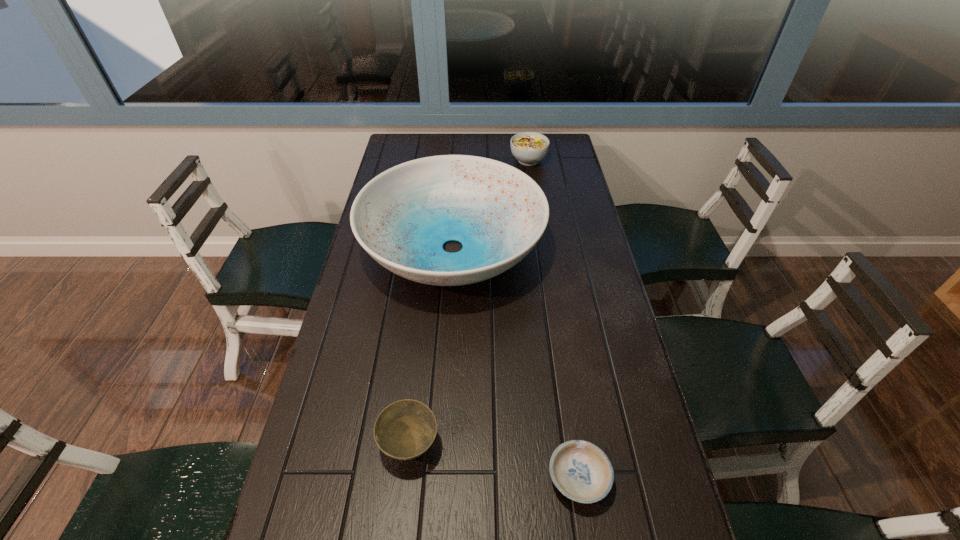
Find the location of a particular element. the tallest object is located at coordinates (402, 218).

Identify the location of the second farthest object. The image size is (960, 540). (402, 218).

Where is `the farthest object`? The width and height of the screenshot is (960, 540). the farthest object is located at coordinates (529, 148).

The image size is (960, 540). In order to click on the taller bowl in this screenshot , I will do `click(406, 429)`.

What are the coordinates of `the shortest object` in the screenshot? It's located at (581, 471).

The width and height of the screenshot is (960, 540). Find the location of `the shorter bowl`. the shorter bowl is located at coordinates (581, 471).

Image resolution: width=960 pixels, height=540 pixels. I want to click on free space located 0.120m on the right of the second farthest object, so click(x=582, y=248).

Locate an element on the screen. vacant space situated 0.120m on the left of the farthest object is located at coordinates (480, 160).

You are a GUI agent. You are given a task and a screenshot of the screen. Output one action in this format:
    pyautogui.click(x=<x>, y=<y>)
    Task: Click on the vacant space located on the left of the left bowl
    The image size is (960, 540).
    Given the screenshot: What is the action you would take?
    pyautogui.click(x=324, y=444)

I want to click on free region located 0.260m on the left of the shortest object, so click(418, 480).